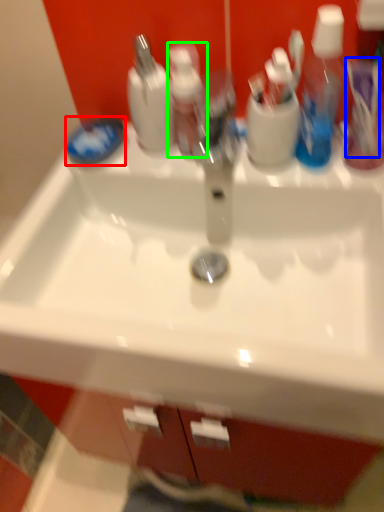
Question: Which is nearer to the soap (highlighted by a red box)? toothbrush (highlighted by a blue box) or toiletry (highlighted by a green box).

Choices:
 (A) toothbrush
 (B) toiletry

Answer: (B)